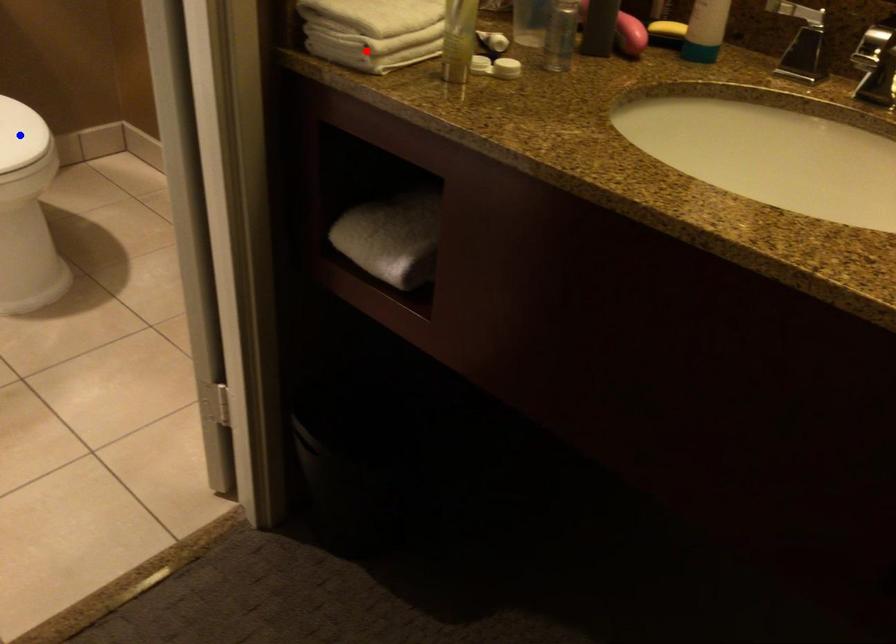
Question: Which of the two points in the image is closer to the camera?

Choices:
 (A) Blue point is closer.
 (B) Red point is closer.

Answer: (B)